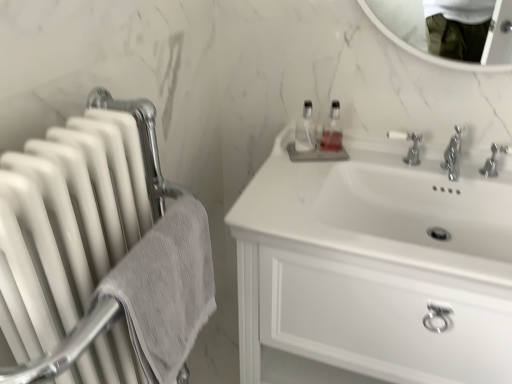
Locate an element on the screen. The image size is (512, 384). vacant space that's between clear glass bottle at center and silver metallic tap at upper center, marked as the second tap in a right-to-left arrangement is located at coordinates (356, 163).